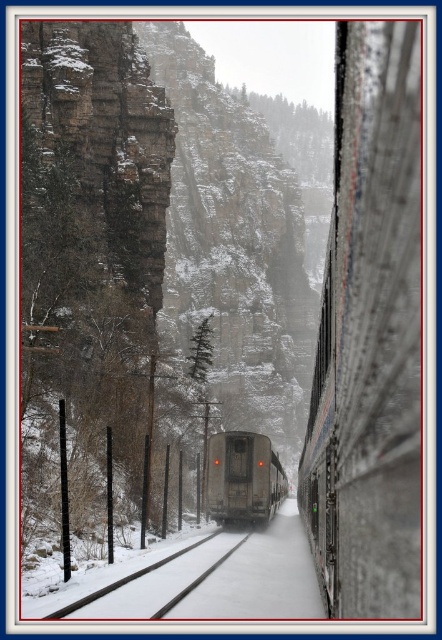
Question: Among these points, which one is nearest to the camera?

Choices:
 (A) coord(133,572)
 (B) coord(243,481)

Answer: (A)

Question: Is gray metallic train at center positioned in front of snow-covered metal track at center?

Choices:
 (A) no
 (B) yes

Answer: (A)

Question: Does gray metallic train at center have a greater width compared to snow-covered metal track at center?

Choices:
 (A) yes
 (B) no

Answer: (A)

Question: Observing the image, what is the correct spatial positioning of gray metallic train at center in reference to snow-covered metal track at center?

Choices:
 (A) below
 (B) above

Answer: (A)

Question: Which object appears farthest from the camera in this image?

Choices:
 (A) gray metallic train at center
 (B) snow-covered metal track at center

Answer: (A)